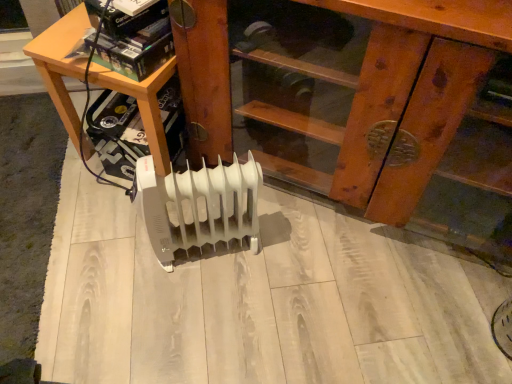
Question: Is white plastic heater at center inside the boundaries of wooden at left, or outside?

Choices:
 (A) outside
 (B) inside

Answer: (A)

Question: Considering the positions of point (146, 208) and point (59, 72), is point (146, 208) closer or farther from the camera than point (59, 72)?

Choices:
 (A) closer
 (B) farther

Answer: (A)

Question: Which of these objects is positioned closest to the white plastic heater at center?

Choices:
 (A) white plastic heater at center
 (B) wooden at left

Answer: (B)

Question: Which is farther from the wooden at left?

Choices:
 (A) white plastic heater at center
 (B) white plastic heater at center

Answer: (A)